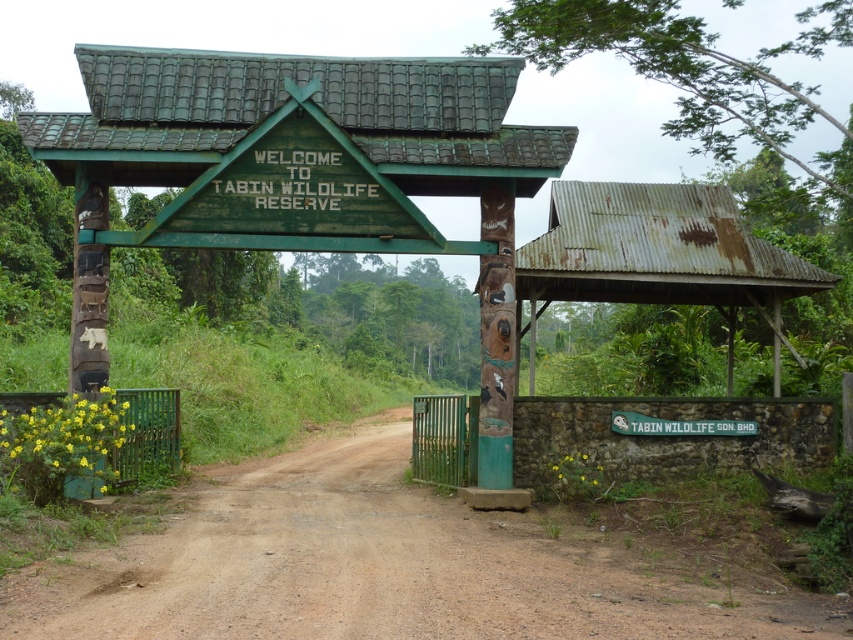
Question: Is brown dirt track at center to the right of green wooden sign at center from the viewer's perspective?

Choices:
 (A) no
 (B) yes

Answer: (B)

Question: Which is nearer to the brown dirt track at center?

Choices:
 (A) rusty corrugated metal hut at right
 (B) rusty corrugated metal hut at center
 (C) green wooden sign at center
 (D) white plastic sign at center

Answer: (D)

Question: Can you confirm if green wooden sign at center is smaller than white plastic sign at center?

Choices:
 (A) yes
 (B) no

Answer: (B)

Question: Is brown dirt track at center bigger than rusty corrugated metal hut at right?

Choices:
 (A) yes
 (B) no

Answer: (B)

Question: Which of the following is the closest to the observer?

Choices:
 (A) (352, 228)
 (B) (618, 410)
 (C) (665, 292)

Answer: (A)

Question: Considering the real-world distances, which object is closest to the green wooden sign at center?

Choices:
 (A) rusty corrugated metal hut at right
 (B) brown dirt track at center
 (C) white plastic sign at center

Answer: (A)